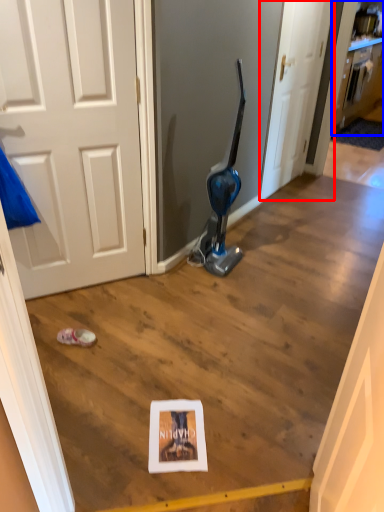
Question: Which point is further to the camera, door (highlighted by a red box) or cabinetry (highlighted by a blue box)?

Choices:
 (A) door
 (B) cabinetry

Answer: (B)